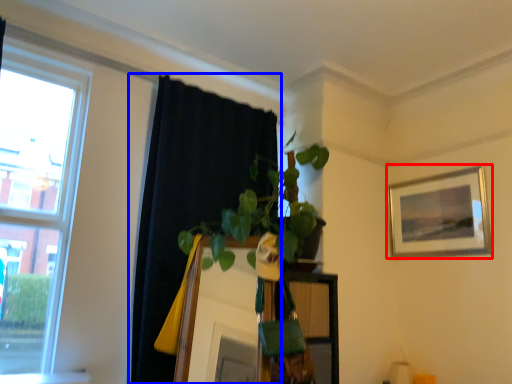
Question: Among these objects, which one is nearest to the camera, picture frame (highlighted by a red box) or curtain (highlighted by a blue box)?

Choices:
 (A) picture frame
 (B) curtain

Answer: (B)